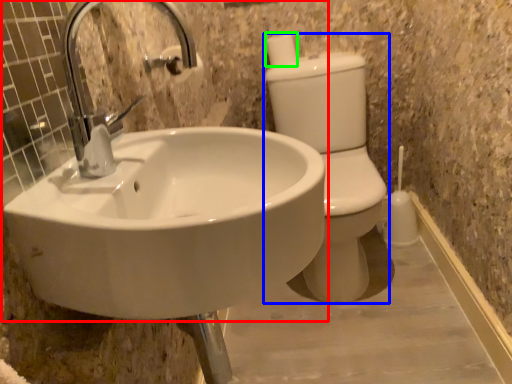
Question: Which object is positioned closest to sink (highlighted by a red box)? Select from toilet bowl (highlighted by a blue box) and toilet paper (highlighted by a green box).

Choices:
 (A) toilet bowl
 (B) toilet paper

Answer: (A)